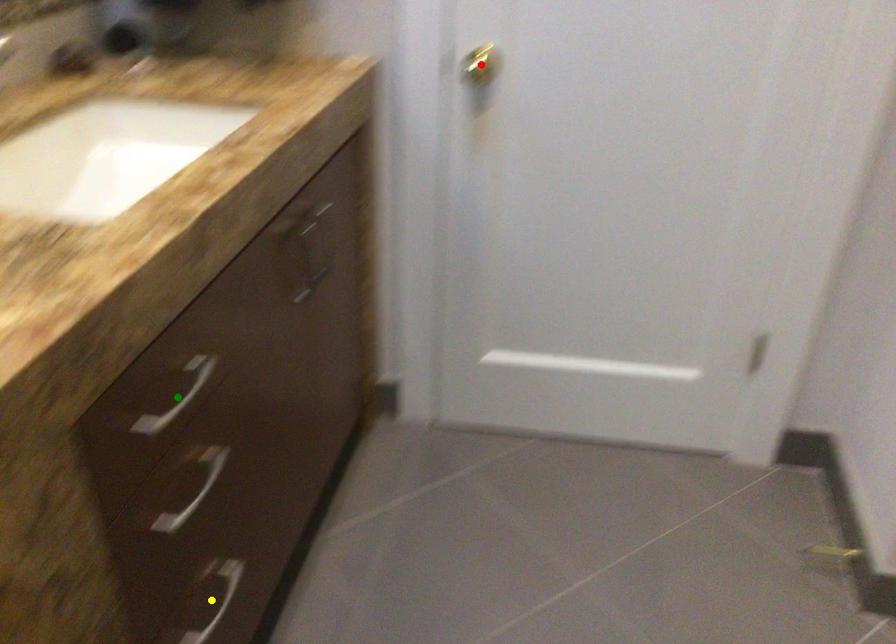
Based on the photo, order these from nearest to farthest:
- green point
- red point
- yellow point

green point < yellow point < red point